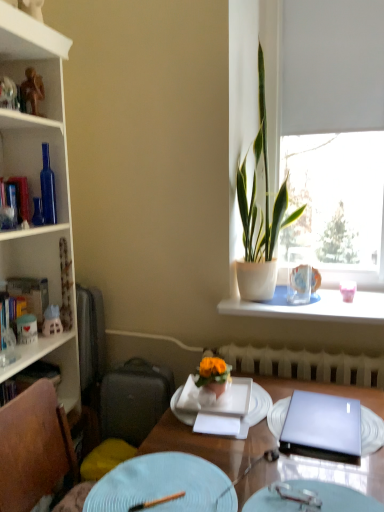
Find the location of a particular element. The width and height of the screenshot is (384, 512). vacant space in between satin purple laptop at center and metallic silver fork at center, marked as the second tableware in a right-to-left arrangement is located at coordinates (312, 476).